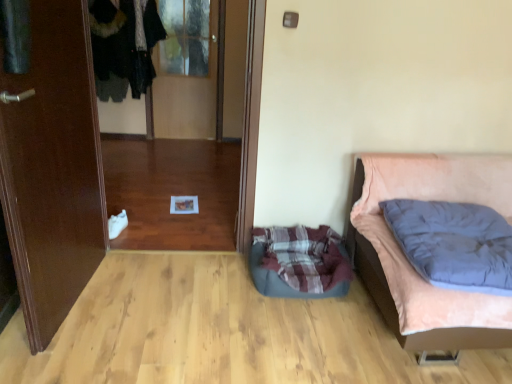
Measure the distance between point (86, 266) and camera.

A distance of 2.27 meters exists between point (86, 266) and camera.

Based on the photo, measure the distance between plaid fabric dog bed at lower center and camera.

plaid fabric dog bed at lower center is 2.23 meters away from camera.

At what (x,y) coordinates should I click in order to perform the action: click on transparent glass door at upper center, the first glass door viewed from the top. Please return your answer as a coordinate pair (x, y). The width and height of the screenshot is (512, 384). Looking at the image, I should click on (187, 89).

Is brown wooden door at left beside velvet pink bed at right?

No, brown wooden door at left is not in contact with velvet pink bed at right.

From the image's perspective, is brown wooden door at left located beneath velvet pink bed at right?

Actually, brown wooden door at left appears above velvet pink bed at right in the image.

From a real-world perspective, is brown wooden door at left positioned under velvet pink bed at right based on gravity?

No, from a real-world perspective, brown wooden door at left is not below velvet pink bed at right.

You are a GUI agent. You are given a task and a screenshot of the screen. Output one action in this format:
    pyautogui.click(x=<x>, y=<y>)
    Task: Click on the door located in front of the velvet pink bed at right
    The width and height of the screenshot is (512, 384).
    Given the screenshot: What is the action you would take?
    pyautogui.click(x=53, y=168)

In terms of size, does dark blue quilted pillow at right appear bigger or smaller than brown wooden door at left?

Considering their sizes, dark blue quilted pillow at right takes up less space than brown wooden door at left.

Which is more to the left, dark blue quilted pillow at right or brown wooden door at left?

brown wooden door at left is more to the left.

Is dark blue quilted pillow at right outside of brown wooden door at left?

dark blue quilted pillow at right is positioned outside brown wooden door at left.

Is there a large distance between dark blue quilted pillow at right and brown wooden door at left?

dark blue quilted pillow at right is far away from brown wooden door at left.

Does velvet-like black coat at upper left turn towards transparent glass door at upper center, the 1th glass door viewed from the back?

No, velvet-like black coat at upper left is not aimed at transparent glass door at upper center, the 1th glass door viewed from the back.

Between velvet-like black coat at upper left and transparent glass door at upper center, the 2th glass door in the front-to-back sequence, which one has less height?

With less height is velvet-like black coat at upper left.

Is velvet-like black coat at upper left spatially inside transparent glass door at upper center, which is the second glass door in bottom-to-top order, or outside of it?

velvet-like black coat at upper left is located beyond the bounds of transparent glass door at upper center, which is the second glass door in bottom-to-top order.

How distant is velvet pink bed at right from transparent glass door at center, marked as the second glass door in a back-to-front arrangement?

velvet pink bed at right is 3.69 feet from transparent glass door at center, marked as the second glass door in a back-to-front arrangement.

In terms of height, does velvet pink bed at right look taller or shorter compared to transparent glass door at center, arranged as the 1th glass door when ordered from the bottom?

Clearly, velvet pink bed at right is shorter compared to transparent glass door at center, arranged as the 1th glass door when ordered from the bottom.

Which is correct: velvet pink bed at right is inside transparent glass door at center, marked as the second glass door in a back-to-front arrangement, or outside of it?

velvet pink bed at right is spatially situated outside transparent glass door at center, marked as the second glass door in a back-to-front arrangement.

In the scene shown: Is brown wooden door at left wider than transparent glass door at upper center, the 1th glass door viewed from the back?

Yes.

Considering the positions of point (36, 240) and point (208, 115), is point (36, 240) closer or farther from the camera than point (208, 115)?

Point (36, 240) is closer to the camera than point (208, 115).

Between plaid fabric dog bed at lower center and transparent glass door at upper center, the 1th glass door viewed from the back, which one appears on the right side from the viewer's perspective?

plaid fabric dog bed at lower center is more to the right.

Is plaid fabric dog bed at lower center located outside transparent glass door at upper center, the first glass door viewed from the top?

Yes.

Consider the image. Which is behind, plaid fabric dog bed at lower center or transparent glass door at upper center, the 2th glass door in the front-to-back sequence?

transparent glass door at upper center, the 2th glass door in the front-to-back sequence, is further away from the camera.

Is plaid fabric dog bed at lower center far away from transparent glass door at upper center, the 1th glass door viewed from the back?

Yes, plaid fabric dog bed at lower center and transparent glass door at upper center, the 1th glass door viewed from the back, are quite far apart.

Between transparent glass door at upper center, the 1th glass door viewed from the back, and plaid fabric dog bed at lower center, which one is positioned in front?

plaid fabric dog bed at lower center is in front.

Who is smaller, transparent glass door at upper center, the first glass door viewed from the top, or plaid fabric dog bed at lower center?

plaid fabric dog bed at lower center.

Is point (196, 109) in front of point (306, 229)?

That is False.

In terms of height, does transparent glass door at upper center, the 2th glass door in the front-to-back sequence, look taller or shorter compared to plaid fabric dog bed at lower center?

Considering their sizes, transparent glass door at upper center, the 2th glass door in the front-to-back sequence, has more height than plaid fabric dog bed at lower center.

The width and height of the screenshot is (512, 384). I want to click on furniture below the brown wooden door at left (from the image's perspective), so click(411, 265).

At what (x,y) coordinates should I click in order to perform the action: click on pillow behind the brown wooden door at left. Please return your answer as a coordinate pair (x, y). This screenshot has width=512, height=384. Looking at the image, I should click on (454, 243).

Estimate the real-world distances between objects in this image. Which object is closer to dark blue quilted pillow at right, brown wooden door at left or velvet-like black coat at upper left?

brown wooden door at left is positioned closer to the anchor dark blue quilted pillow at right.

From the image, which object appears to be farther from dark blue quilted pillow at right, velvet-like black coat at upper left or velvet pink bed at right?

velvet-like black coat at upper left is further to dark blue quilted pillow at right.

When comparing their distances from velvet pink bed at right, does plaid fabric dog bed at lower center or transparent glass door at center, placed as the 2th glass door when sorted from top to bottom, seem closer?

plaid fabric dog bed at lower center lies closer to velvet pink bed at right than the other object.

Based on their spatial positions, is transparent glass door at center, placed as the 2th glass door when sorted from top to bottom, or plaid fabric dog bed at lower center further from velvet pink bed at right?

Among the two, transparent glass door at center, placed as the 2th glass door when sorted from top to bottom, is located further to velvet pink bed at right.

Looking at the image, which one is located closer to dark blue quilted pillow at right, transparent glass door at center, which appears as the first glass door when viewed from the front, or velvet pink bed at right?

velvet pink bed at right.

Which object lies nearer to the anchor point plaid fabric dog bed at lower center, dark blue quilted pillow at right or velvet pink bed at right?

Based on the image, velvet pink bed at right appears to be nearer to plaid fabric dog bed at lower center.

Estimate the real-world distances between objects in this image. Which object is closer to velvet pink bed at right, dark blue quilted pillow at right or transparent glass door at upper center, which is the second glass door in bottom-to-top order?

Based on the image, dark blue quilted pillow at right appears to be nearer to velvet pink bed at right.

Based on their spatial positions, is velvet-like black coat at upper left or transparent glass door at center, which appears as the first glass door when viewed from the front, closer to brown wooden door at left?

Based on the image, transparent glass door at center, which appears as the first glass door when viewed from the front, appears to be nearer to brown wooden door at left.

You are a GUI agent. You are given a task and a screenshot of the screen. Output one action in this format:
    pyautogui.click(x=<x>, y=<y>)
    Task: Click on the pillow between brown wooden door at left and transparent glass door at upper center, the first glass door viewed from the top, in the front-back direction
    
    Given the screenshot: What is the action you would take?
    pyautogui.click(x=454, y=243)

Locate an element on the screen. dog bed between dark blue quilted pillow at right and transparent glass door at upper center, the 1th glass door viewed from the back, in the front-back direction is located at coordinates point(298,262).

This screenshot has width=512, height=384. I want to click on clothing between brown wooden door at left and transparent glass door at upper center, which is the second glass door in bottom-to-top order, along the z-axis, so click(124, 45).

The image size is (512, 384). In order to click on pillow positioned between brown wooden door at left and velvet-like black coat at upper left from near to far in this screenshot , I will do `click(454, 243)`.